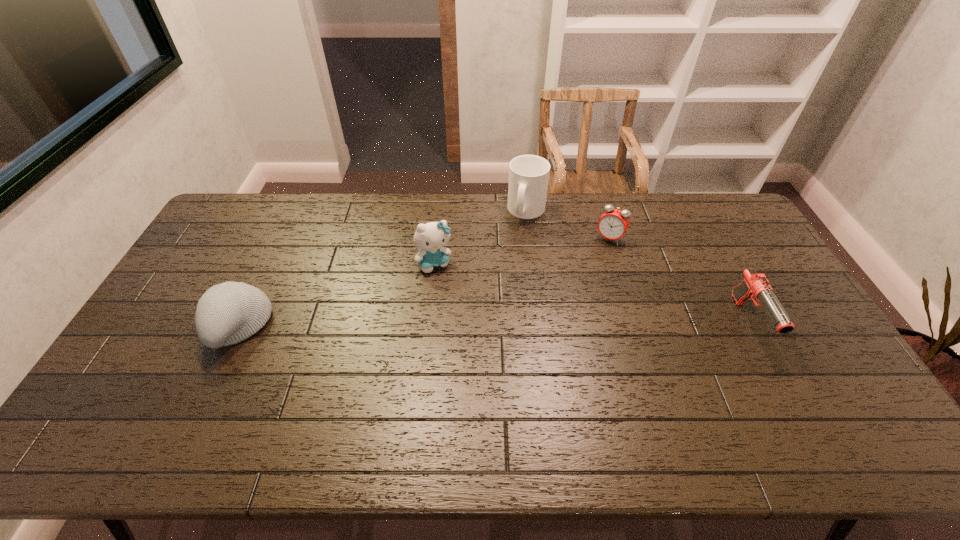
Where is `vacant region located on the face of the kitten`? vacant region located on the face of the kitten is located at coordinates (492, 370).

Find the location of a particular element. The image size is (960, 540). vacant space located on the face of the kitten is located at coordinates (474, 337).

Where is `free space located on the face of the kitten`? The height and width of the screenshot is (540, 960). free space located on the face of the kitten is located at coordinates (448, 289).

This screenshot has height=540, width=960. Identify the location of blank space located on the handle side of the farthest object. (519, 276).

Identify the location of vacant region located 0.230m on the handle side of the farthest object. (520, 272).

What are the coordinates of `free space located on the handle side of the farthest object` in the screenshot? It's located at (523, 245).

This screenshot has height=540, width=960. Find the location of `vacant space located 0.280m on the front-facing side of the alarm clock`. vacant space located 0.280m on the front-facing side of the alarm clock is located at coordinates (573, 299).

You are a GUI agent. You are given a task and a screenshot of the screen. Output one action in this format:
    pyautogui.click(x=<x>, y=<y>)
    Task: Click on the free space located on the front-facing side of the alarm clock
    The width and height of the screenshot is (960, 540).
    Given the screenshot: What is the action you would take?
    pyautogui.click(x=593, y=264)

Find the location of `free spot located on the front-facing side of the alarm clock`. free spot located on the front-facing side of the alarm clock is located at coordinates (596, 260).

The image size is (960, 540). Identify the location of mug situated at the far edge. (528, 174).